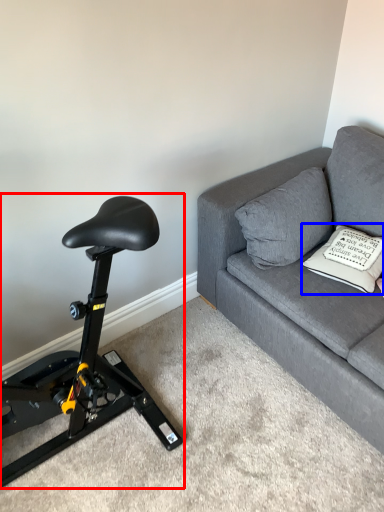
Question: Which object is closer to the camera taking this photo, stationary bicycle (highlighted by a red box) or pillow (highlighted by a blue box)?

Choices:
 (A) stationary bicycle
 (B) pillow

Answer: (A)